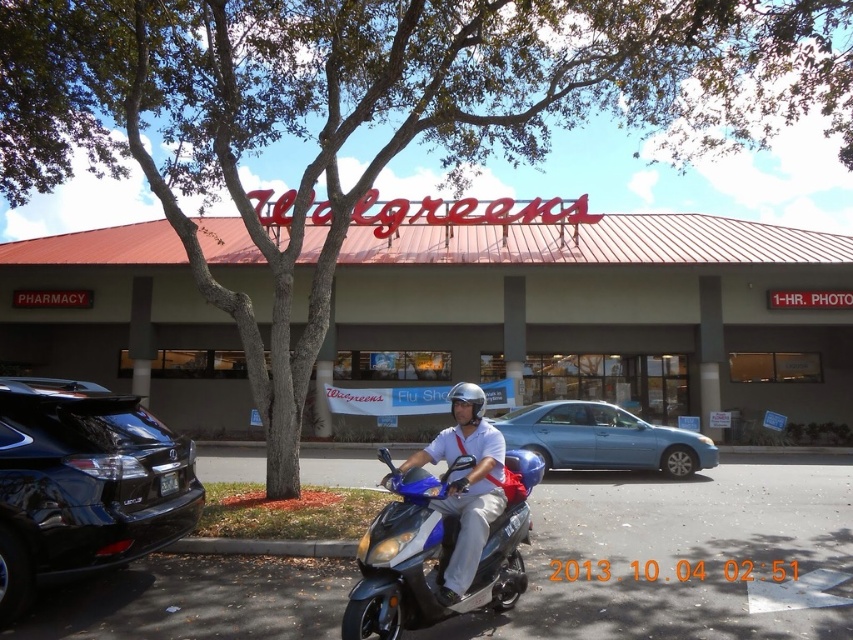
Question: From the image, what is the correct spatial relationship of matte blue scooter at center in relation to blue matte helmet at center?

Choices:
 (A) above
 (B) below

Answer: (B)

Question: Which point is closer to the camera taking this photo?

Choices:
 (A) (463, 384)
 (B) (492, 531)
 (C) (521, 497)

Answer: (B)

Question: Based on their relative distances, which object is farther from the blue matte helmet at center?

Choices:
 (A) white matte helmet at center
 (B) metallic blue scooter at center

Answer: (A)

Question: Does metallic blue scooter at center come in front of matte blue scooter at center?

Choices:
 (A) yes
 (B) no

Answer: (A)

Question: In this image, where is metallic blue scooter at center located relative to matte blue scooter at center?

Choices:
 (A) left
 (B) right

Answer: (A)

Question: Which point appears farthest from the camera in this image?

Choices:
 (A) (474, 492)
 (B) (456, 394)
 (C) (352, 420)

Answer: (C)